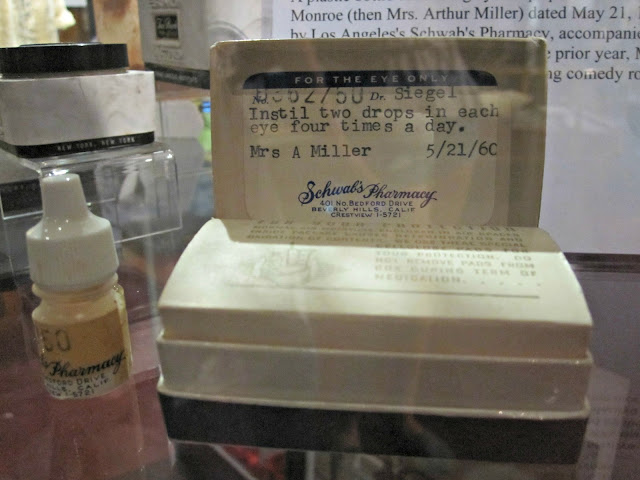
This screenshot has width=640, height=480. I want to click on display behind glass, so click(86, 97), click(547, 104), click(518, 389), click(104, 395).